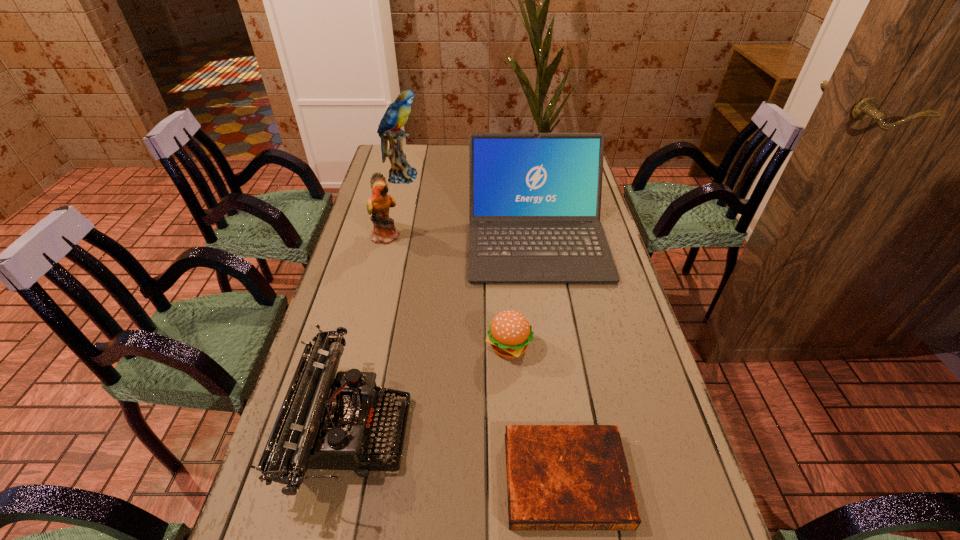
Locate an element on the screen. The image size is (960, 540). the farthest object is located at coordinates (396, 115).

You are a GUI agent. You are given a task and a screenshot of the screen. Output one action in this format:
    pyautogui.click(x=<x>, y=<y>)
    Task: Click on the taller parrot
    
    Given the screenshot: What is the action you would take?
    pyautogui.click(x=396, y=115)

Where is `laptop computer`? laptop computer is located at coordinates (534, 198).

Image resolution: width=960 pixels, height=540 pixels. I want to click on the nearer parrot, so click(378, 204).

Where is `the fourth tallest object`? This screenshot has height=540, width=960. the fourth tallest object is located at coordinates (325, 422).

Identify the location of the second shortest object. The width and height of the screenshot is (960, 540). (509, 334).

In order to click on the shortest object in this screenshot , I will do `click(559, 477)`.

Where is `free space located 0.280m on the face of the farthest object`? free space located 0.280m on the face of the farthest object is located at coordinates (493, 177).

This screenshot has width=960, height=540. I want to click on free region located on the screen of the laptop computer, so click(560, 392).

Where is `vacant space situated 0.050m on the front-facing side of the shorter parrot`? This screenshot has width=960, height=540. vacant space situated 0.050m on the front-facing side of the shorter parrot is located at coordinates point(417,236).